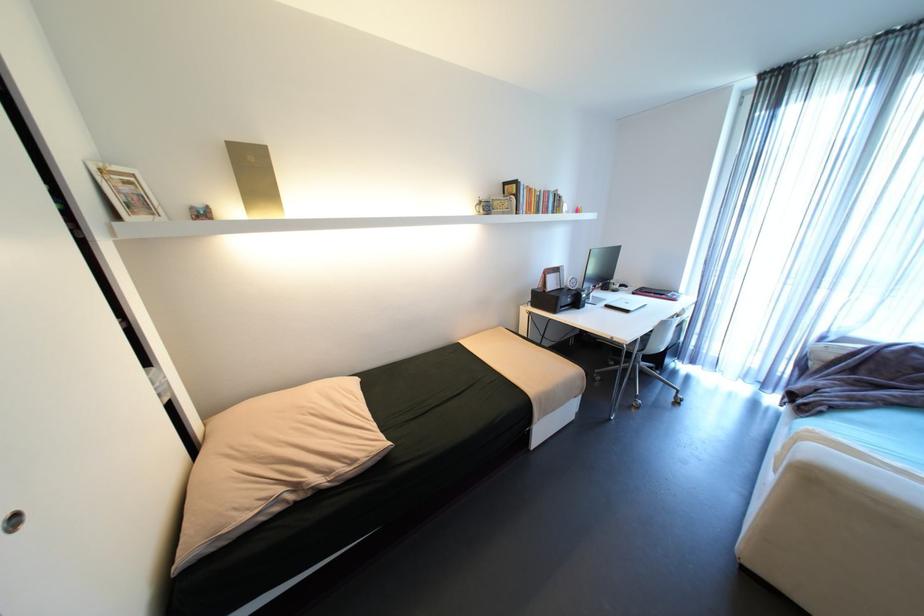
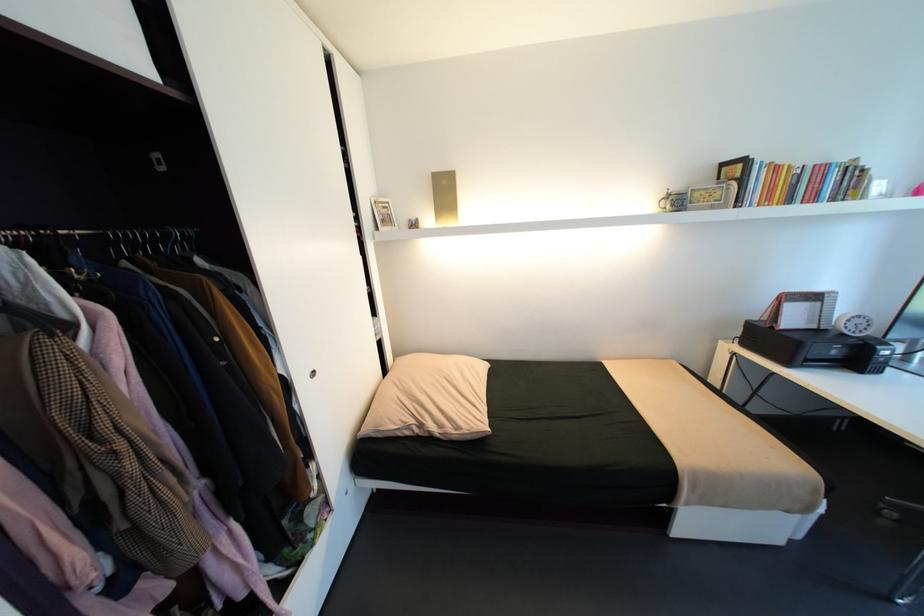
In the second image, find the point that corresponds to the point at 552,191 in the first image.

(821, 166)